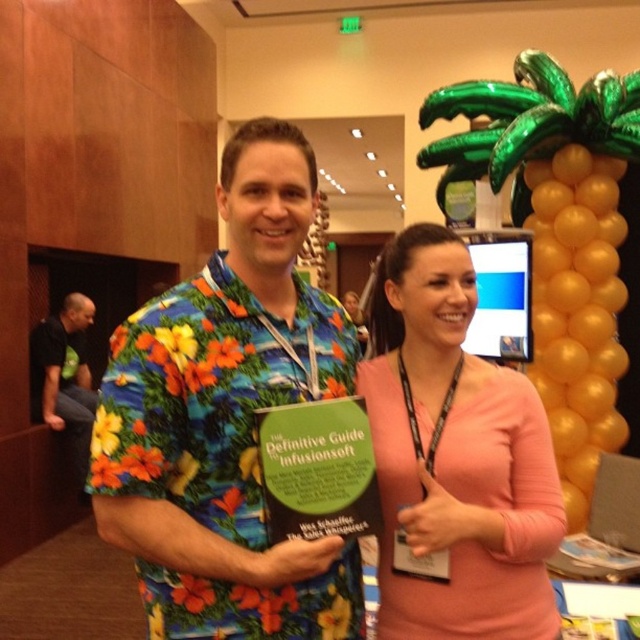
Question: Is floral print shirt at center below black fabric shirt at left?

Choices:
 (A) no
 (B) yes

Answer: (A)

Question: Where is floral print shirt at center located in relation to black fabric shirt at left in the image?

Choices:
 (A) below
 (B) above

Answer: (B)

Question: Which point is farther to the camera?

Choices:
 (A) pink matte shirt at center
 (B) floral print shirt at center

Answer: (A)

Question: Does pink matte shirt at center appear under black fabric shirt at left?

Choices:
 (A) no
 (B) yes

Answer: (A)

Question: Which object appears closest to the camera in this image?

Choices:
 (A) floral print shirt at center
 (B) black fabric shirt at left
 (C) pink matte shirt at center

Answer: (A)

Question: Based on their relative distances, which object is farther from the floral print shirt at center?

Choices:
 (A) pink matte shirt at center
 (B) black fabric shirt at left

Answer: (B)